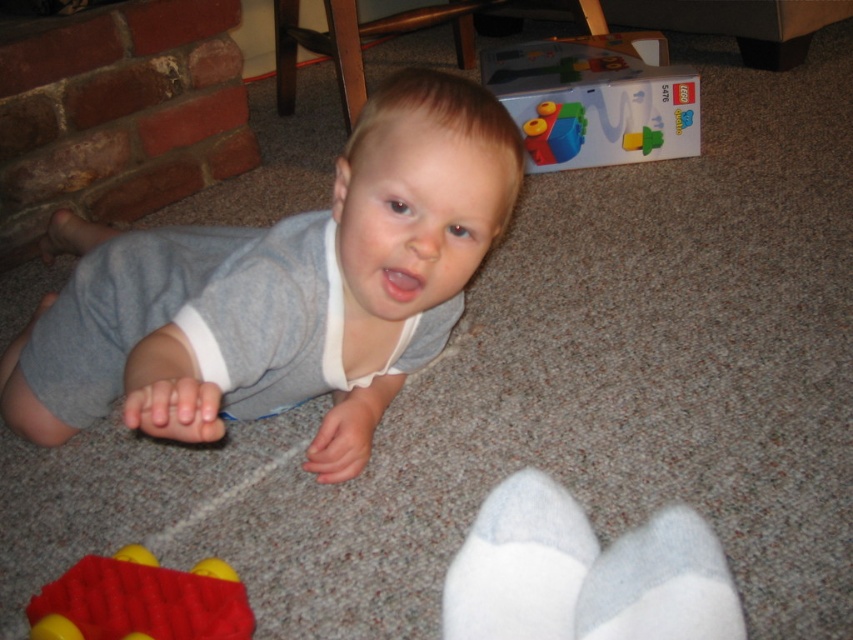
Which of these two, white soft socks at lower center or matte plastic toy at upper center, stands shorter?

white soft socks at lower center is shorter.

Which is more to the left, white soft socks at lower center or matte plastic toy at upper center?

From the viewer's perspective, white soft socks at lower center appears more on the left side.

Is point (474, 593) behind point (643, 86)?

No, it is not.

I want to click on white soft socks at lower center, so click(584, 573).

Can you confirm if matte plastic toy at upper center is bigger than translucent plastic blocks at upper center?

Correct, matte plastic toy at upper center is larger in size than translucent plastic blocks at upper center.

Does matte plastic toy at upper center lie behind translucent plastic blocks at upper center?

No, matte plastic toy at upper center is closer to the viewer.

The width and height of the screenshot is (853, 640). In order to click on matte plastic toy at upper center in this screenshot , I will do `click(593, 104)`.

Which is below, rubberized red toy at lower left or translucent plastic blocks at upper center?

rubberized red toy at lower left is lower down.

Find the location of a particular element. The width and height of the screenshot is (853, 640). rubberized red toy at lower left is located at coordinates (141, 600).

The height and width of the screenshot is (640, 853). Identify the location of rubberized red toy at lower left. (141, 600).

The width and height of the screenshot is (853, 640). In order to click on rubberized red toy at lower left in this screenshot , I will do `click(141, 600)`.